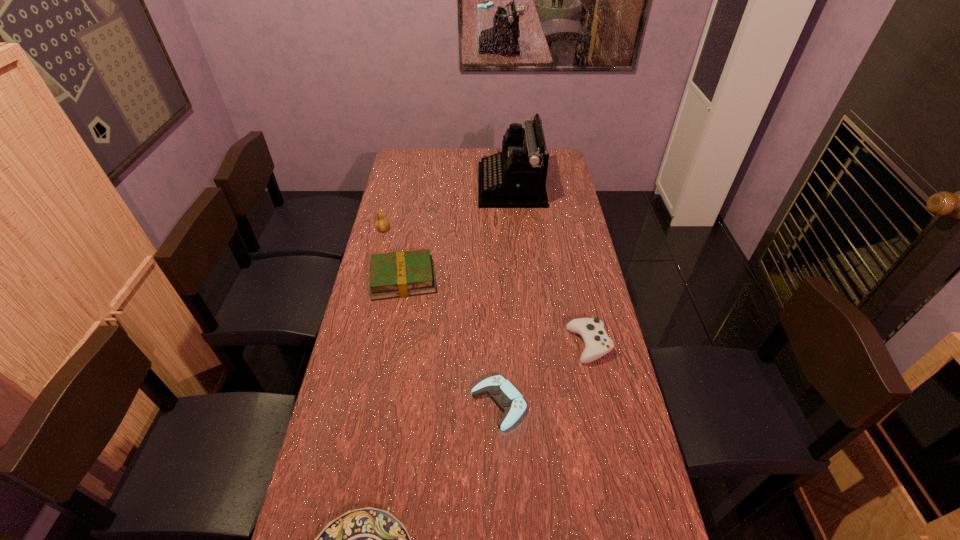
Locate an element on the screen. This screenshot has width=960, height=540. the tallest object is located at coordinates (516, 177).

Find the location of a particular element. the farthest object is located at coordinates point(516,177).

Where is `pear`? pear is located at coordinates (382, 223).

Where is `the second farthest object`? The image size is (960, 540). the second farthest object is located at coordinates (382, 223).

Locate an element on the screen. the third farthest object is located at coordinates click(x=407, y=273).

Identify the location of the farther control. (597, 343).

Find the location of `the taller control`. the taller control is located at coordinates (597, 343).

The height and width of the screenshot is (540, 960). I want to click on the shorter control, so click(507, 397).

At what (x,y) coordinates should I click in order to perform the action: click on the second nearest object. Please return your answer as a coordinate pair (x, y). Looking at the image, I should click on (507, 397).

Find the location of a particular element. This screenshot has height=540, width=960. free space located on the typing side of the tallest object is located at coordinates (450, 186).